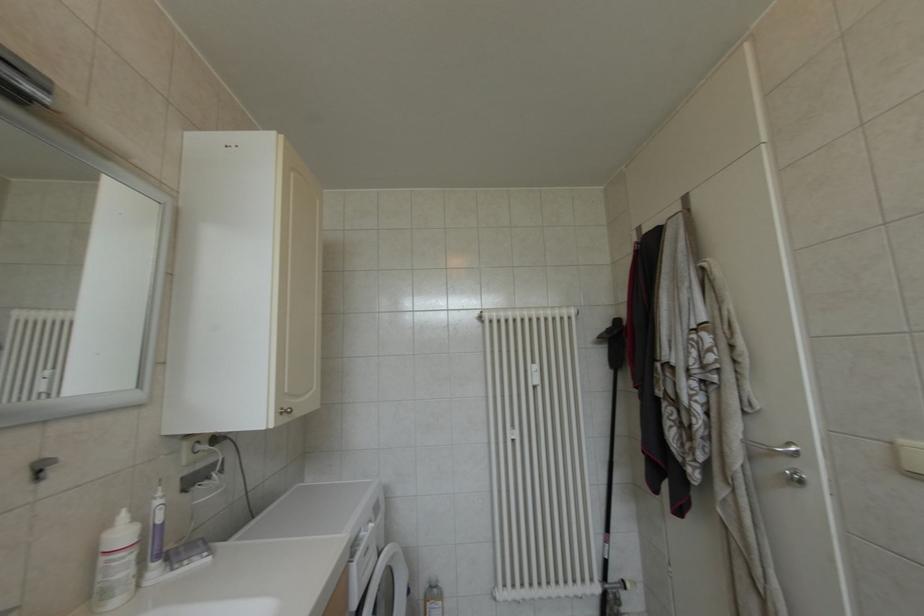
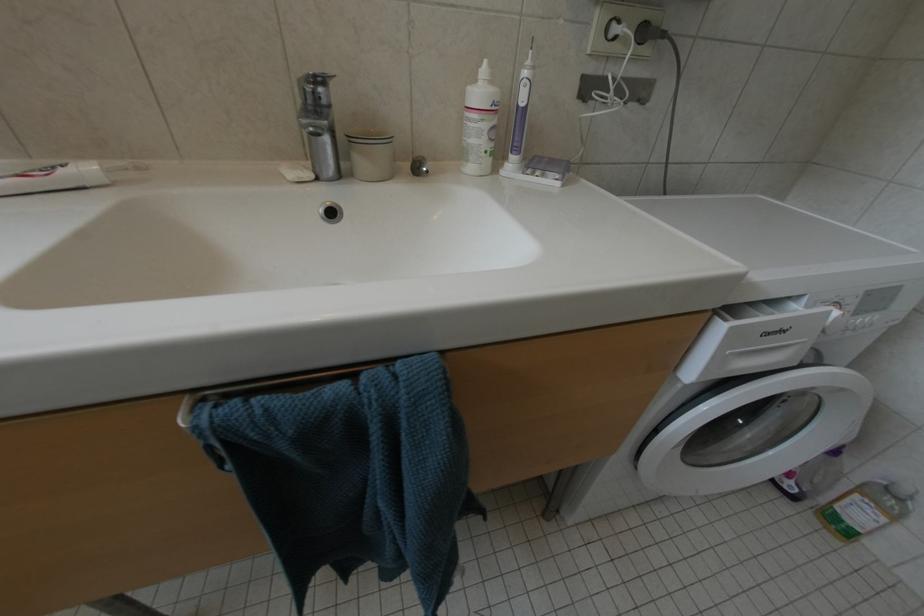
First-person continuous shooting, in which direction is the camera rotating?

The rotation direction of the camera is left-down.